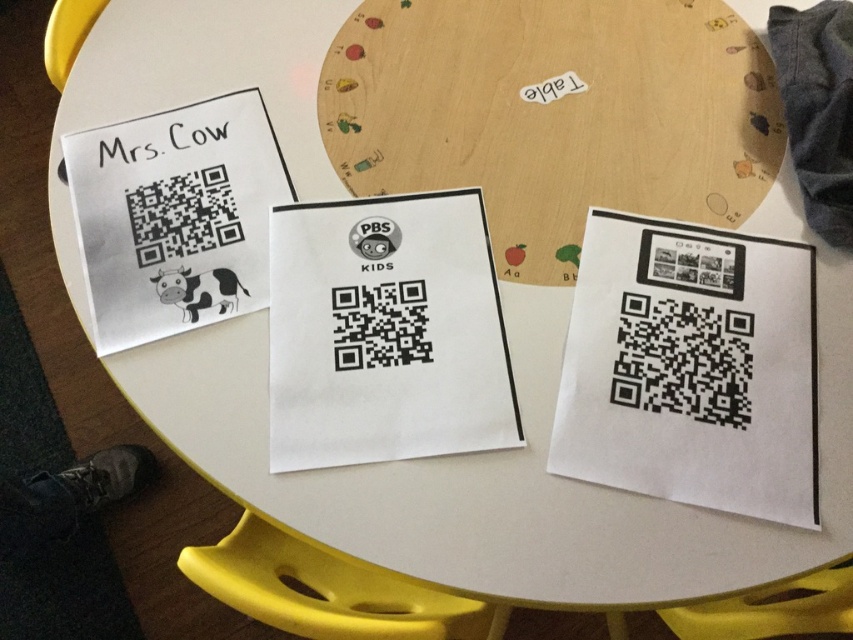
Question: Which object is farther from the camera taking this photo?

Choices:
 (A) black paper at upper left
 (B) white paper qr code at center

Answer: (A)

Question: Which of the following is the closest to the observer?

Choices:
 (A) white paper qr code at upper left
 (B) white paper qr code at center
 (C) yellow plastic chair at lower left

Answer: (C)

Question: Which object appears farthest from the camera in this image?

Choices:
 (A) yellow plastic chair at lower center
 (B) white paper qr code at upper left
 (C) yellow plastic chair at lower left

Answer: (B)

Question: Observing the image, what is the correct spatial positioning of white paper qr code at center in reference to yellow plastic chair at lower center?

Choices:
 (A) above
 (B) below

Answer: (A)

Question: Is the position of yellow plastic chair at lower left less distant than that of yellow plastic chair at lower center?

Choices:
 (A) yes
 (B) no

Answer: (A)

Question: Where is white paper qr code at center located in relation to yellow plastic chair at lower left in the image?

Choices:
 (A) below
 (B) above

Answer: (B)